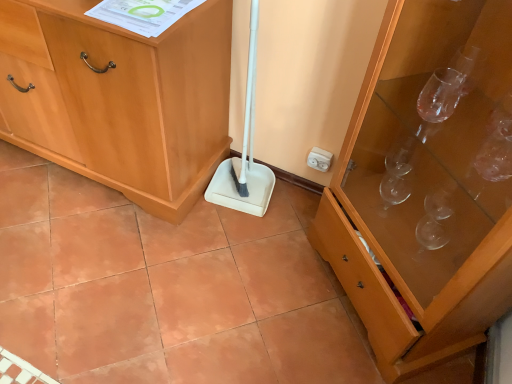
This screenshot has height=384, width=512. In order to click on free space between transparent glass cabinet at right, which ranks as the second cabinetry in left-to-right order, and white plastic shovel at center in this screenshot , I will do `click(283, 249)`.